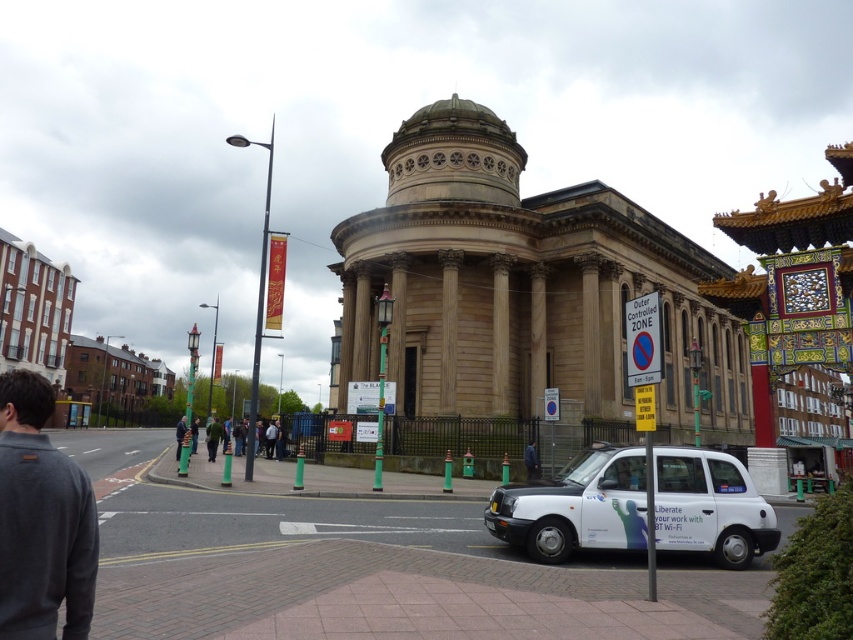
Question: Which of the following is the closest to the observer?

Choices:
 (A) blue fabric jacket at center
 (B) green painted metal pole at center

Answer: (B)

Question: Considering the real-world distances, which object is closest to the dark blue jacket at center?

Choices:
 (A) blue fabric jacket at center
 (B) dark gray fleece at lower left
 (C) green painted metal pole at center
 (D) white matte taxi at lower right

Answer: (C)

Question: Does dark gray fleece at lower left lie behind green painted metal pole at center?

Choices:
 (A) no
 (B) yes

Answer: (A)

Question: Which object is the farthest from the white matte taxi at lower right?

Choices:
 (A) blue fabric jacket at center
 (B) dark gray fleece at lower left

Answer: (B)

Question: Does green painted metal pole at center appear on the right side of dark blue jacket at center?

Choices:
 (A) yes
 (B) no

Answer: (A)

Question: Observing the image, what is the correct spatial positioning of dark gray fleece at lower left in reference to dark blue jacket at center?

Choices:
 (A) above
 (B) below

Answer: (A)